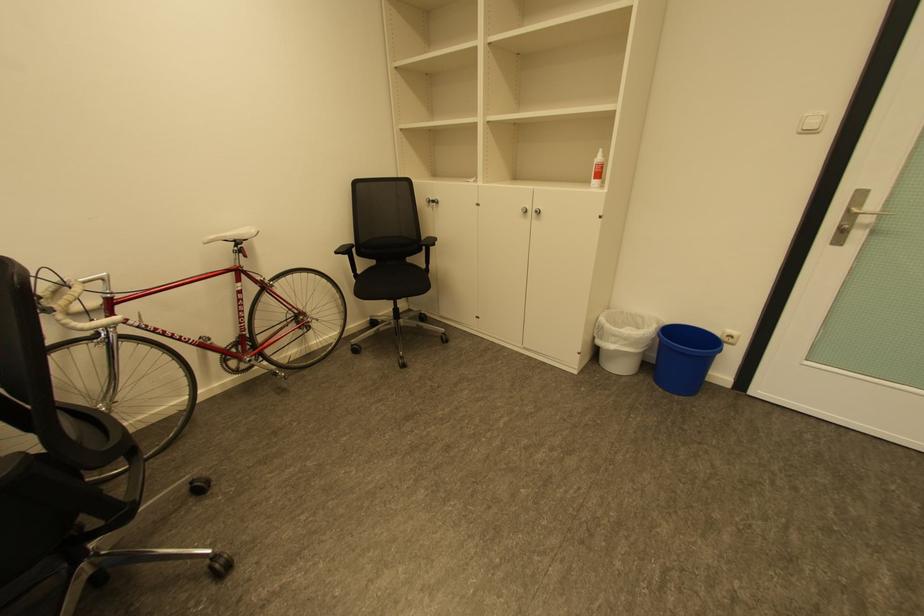
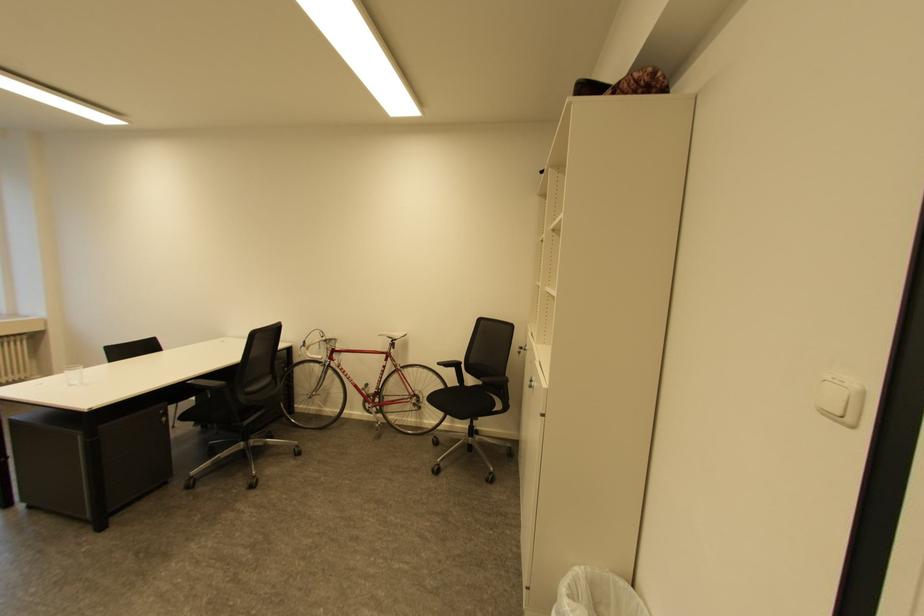
Locate, in the second image, the point that corresponds to point (354, 257) in the first image.

(459, 370)